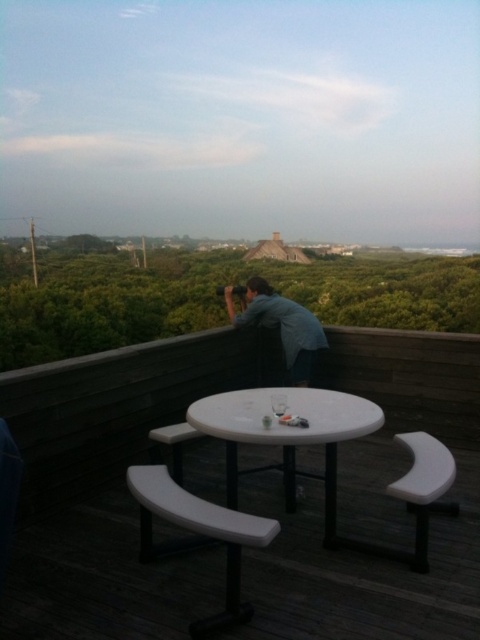
Is white plastic picnic table at center taller than blue denim shirt at upper center?

Incorrect, white plastic picnic table at center's height is not larger of blue denim shirt at upper center's.

Is white plastic picnic table at center to the right of blue denim shirt at upper center from the viewer's perspective?

In fact, white plastic picnic table at center is to the left of blue denim shirt at upper center.

Find the location of `white plastic picnic table at center`. white plastic picnic table at center is located at coordinates (288, 435).